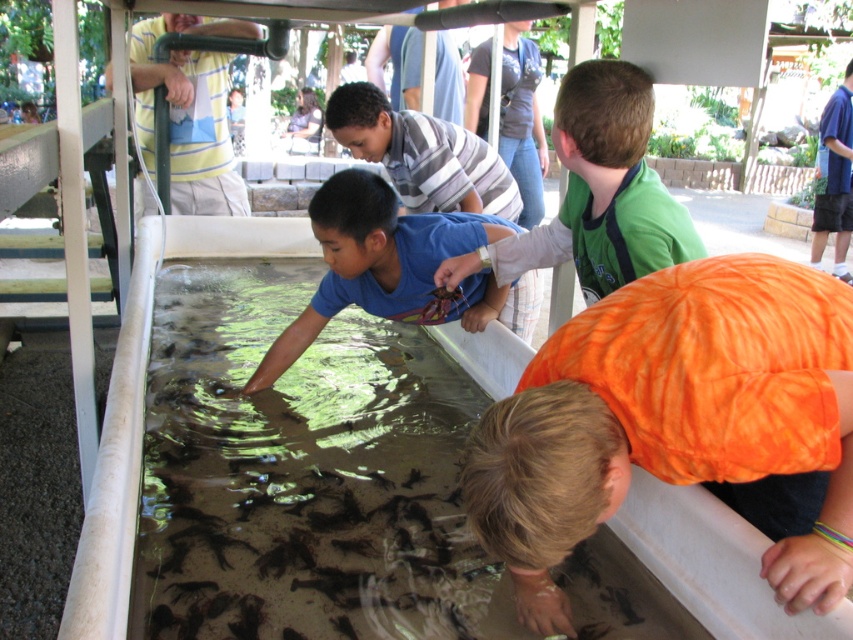
Which is behind, point (648, 436) or point (850, 74)?

The point (850, 74) is behind.

Which is in front, point (677, 420) or point (833, 166)?

Point (677, 420) is in front.

Find the location of a particular element. orange tie-dye shirt at lower right is located at coordinates (665, 406).

Where is `orange tie-dye shirt at lower right`? Image resolution: width=853 pixels, height=640 pixels. orange tie-dye shirt at lower right is located at coordinates (665, 406).

Which is more to the right, orange tie-dye shirt at lower right or blue cotton shirt at center?

Positioned to the right is orange tie-dye shirt at lower right.

Is orange tie-dye shirt at lower right closer to the viewer compared to blue cotton shirt at center?

Yes, it is in front of blue cotton shirt at center.

Describe the element at coordinates (665, 406) in the screenshot. I see `orange tie-dye shirt at lower right` at that location.

Locate an element on the screen. orange tie-dye shirt at lower right is located at coordinates (665, 406).

Does clear plastic tank at center appear on the right side of green matte shirt at upper center?

No, clear plastic tank at center is not to the right of green matte shirt at upper center.

Who is higher up, clear plastic tank at center or green matte shirt at upper center?

Positioned higher is green matte shirt at upper center.

Who is more forward, (421, 433) or (512, 253)?

Point (421, 433) is more forward.

Locate an element on the screen. clear plastic tank at center is located at coordinates (303, 474).